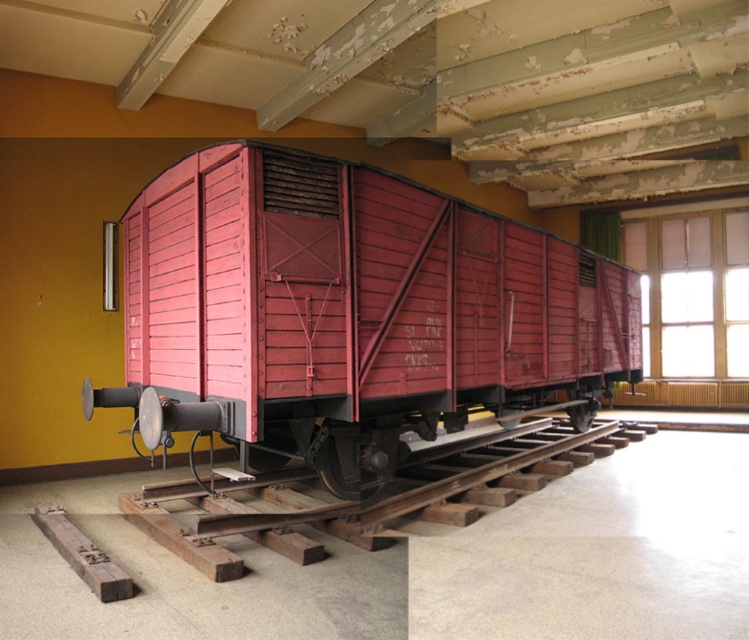
Question: Is matte wood train car at center further to the viewer compared to wooden at center?

Choices:
 (A) yes
 (B) no

Answer: (B)

Question: Which point is closer to the camera?

Choices:
 (A) (580, 454)
 (B) (209, 374)

Answer: (B)

Question: Is matte wood train car at center further to camera compared to wooden at center?

Choices:
 (A) yes
 (B) no

Answer: (B)

Question: Is matte wood train car at center positioned at the back of wooden at center?

Choices:
 (A) yes
 (B) no

Answer: (B)

Question: Which point is farther to the camera?

Choices:
 (A) matte wood train car at center
 (B) wooden at center

Answer: (B)